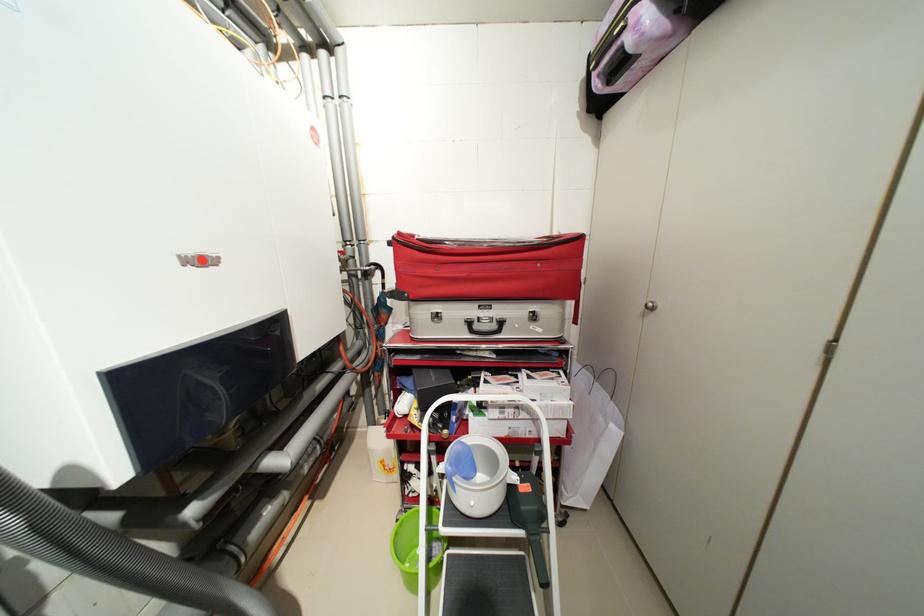
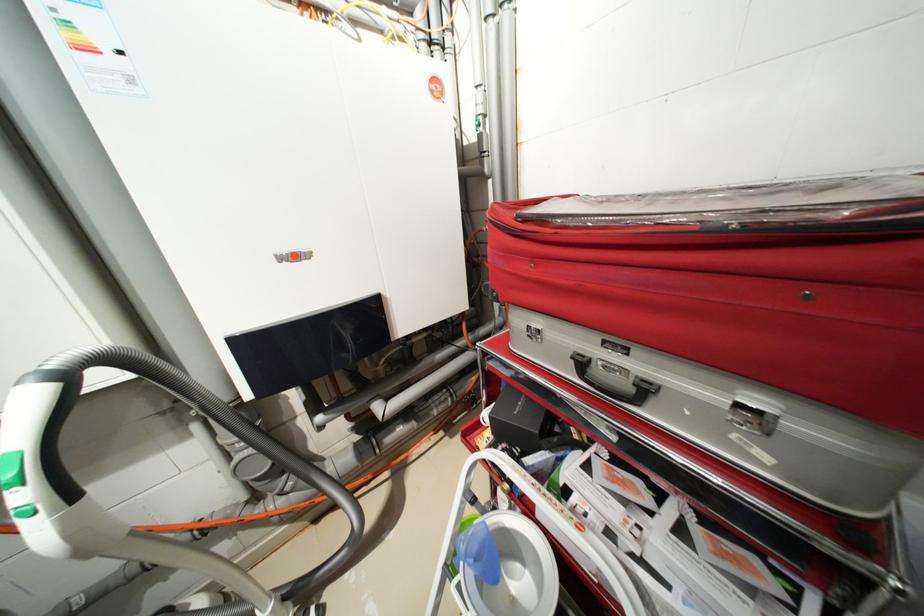
Question: I am providing you with two images of the same scene from different viewpoints. After the viewpoint changes to image2, which objects are now occluded?

Choices:
 (A) silver case handle
 (B) small black box
 (C) silver case latch
 (D) none of these

Answer: (D)